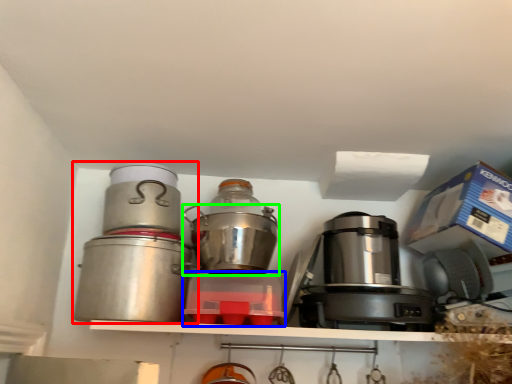
Question: Which object is positioned farthest from kitchen appliance (highlighted by a red box)? Select from kitchen appliance (highlighted by a blue box) and kitchen appliance (highlighted by a green box).

Choices:
 (A) kitchen appliance
 (B) kitchen appliance

Answer: (A)